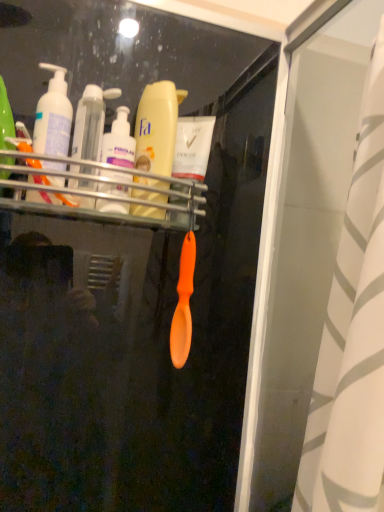
Question: From the image's perspective, is translucent plastic bottles at center, marked as the first toiletry in a right-to-left arrangement, located above translucent plastic bottles at center left, the second toiletry when ordered from right to left?

Choices:
 (A) no
 (B) yes

Answer: (A)

Question: Can you confirm if translucent plastic bottles at center, marked as the first toiletry in a right-to-left arrangement, is smaller than translucent plastic bottles at center left, the second toiletry when ordered from right to left?

Choices:
 (A) yes
 (B) no

Answer: (B)

Question: From a real-world perspective, is translucent plastic bottles at center, arranged as the second toiletry when viewed from the left, over translucent plastic bottles at center left, which ranks as the 1th toiletry in left-to-right order?

Choices:
 (A) no
 (B) yes

Answer: (B)

Question: Is translucent plastic bottles at center, arranged as the second toiletry when viewed from the left, taller than translucent plastic bottles at center left, the second toiletry when ordered from right to left?

Choices:
 (A) yes
 (B) no

Answer: (B)

Question: Considering the relative positions of translucent plastic bottles at center, arranged as the second toiletry when viewed from the left, and translucent plastic bottles at center left, which ranks as the 1th toiletry in left-to-right order, in the image provided, is translucent plastic bottles at center, arranged as the second toiletry when viewed from the left, to the right of translucent plastic bottles at center left, which ranks as the 1th toiletry in left-to-right order, from the viewer's perspective?

Choices:
 (A) no
 (B) yes

Answer: (B)

Question: Does translucent plastic bottles at center, arranged as the second toiletry when viewed from the left, appear on the left side of translucent plastic bottles at center left, which ranks as the 1th toiletry in left-to-right order?

Choices:
 (A) no
 (B) yes

Answer: (A)

Question: Is yellow matte lotion at center shorter than matte white pump bottle at left?

Choices:
 (A) no
 (B) yes

Answer: (A)

Question: Is yellow matte lotion at center at the right side of matte white pump bottle at left?

Choices:
 (A) yes
 (B) no

Answer: (A)

Question: Would you say matte white pump bottle at left is part of yellow matte lotion at center's contents?

Choices:
 (A) no
 (B) yes

Answer: (A)

Question: Is yellow matte lotion at center in front of matte white pump bottle at left?

Choices:
 (A) no
 (B) yes

Answer: (A)

Question: Is yellow matte lotion at center oriented towards matte white pump bottle at left?

Choices:
 (A) yes
 (B) no

Answer: (B)

Question: Is yellow matte lotion at center wider than matte white pump bottle at left?

Choices:
 (A) yes
 (B) no

Answer: (B)

Question: Is the position of white striped fabric at right less distant than that of translucent plastic bottles at center, arranged as the second toiletry when viewed from the left?

Choices:
 (A) yes
 (B) no

Answer: (A)